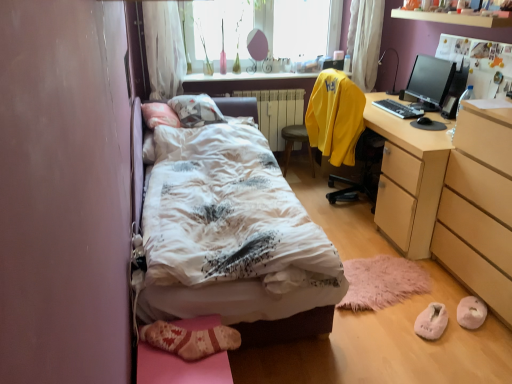
Question: Does wooden shelf at upper center have a larger size compared to white sheer curtain at upper center, which ranks as the 1th curtain in right-to-left order?

Choices:
 (A) yes
 (B) no

Answer: (B)

Question: From the image's perspective, is wooden shelf at upper center below white sheer curtain at upper center, which is the 2th curtain in left-to-right order?

Choices:
 (A) no
 (B) yes

Answer: (B)

Question: Are wooden shelf at upper center and white sheer curtain at upper center, which is the 2th curtain in left-to-right order, located far from each other?

Choices:
 (A) no
 (B) yes

Answer: (A)

Question: Is wooden shelf at upper center facing away from white sheer curtain at upper center, which ranks as the 1th curtain in right-to-left order?

Choices:
 (A) yes
 (B) no

Answer: (B)

Question: Is wooden shelf at upper center beside white sheer curtain at upper center, which ranks as the 1th curtain in right-to-left order?

Choices:
 (A) no
 (B) yes

Answer: (A)

Question: Is point (419, 114) positioned closer to the camera than point (343, 104)?

Choices:
 (A) farther
 (B) closer

Answer: (B)

Question: Would you say black plastic keyboard at right is inside or outside yellow matte sweatshirt at upper right?

Choices:
 (A) inside
 (B) outside

Answer: (B)

Question: Considering their positions, is black plastic keyboard at right located in front of or behind yellow matte sweatshirt at upper right?

Choices:
 (A) behind
 (B) front

Answer: (A)

Question: Looking at their shapes, would you say black plastic keyboard at right is wider or thinner than yellow matte sweatshirt at upper right?

Choices:
 (A) wide
 (B) thin

Answer: (B)

Question: In terms of width, does white metallic radiator at center look wider or thinner when compared to wooden shelf at upper center?

Choices:
 (A) thin
 (B) wide

Answer: (A)

Question: From the image's perspective, is white metallic radiator at center above or below wooden shelf at upper center?

Choices:
 (A) above
 (B) below

Answer: (B)

Question: Is white metallic radiator at center taller or shorter than wooden shelf at upper center?

Choices:
 (A) short
 (B) tall

Answer: (B)

Question: Is white metallic radiator at center spatially inside wooden shelf at upper center, or outside of it?

Choices:
 (A) outside
 (B) inside

Answer: (A)

Question: Relative to black plastic keyboard at right, is white fluffy slippers at lower right, acting as the first shoe starting from the right, in front or behind?

Choices:
 (A) behind
 (B) front

Answer: (B)

Question: In terms of size, does white fluffy slippers at lower right, acting as the first shoe starting from the right, appear bigger or smaller than black plastic keyboard at right?

Choices:
 (A) big
 (B) small

Answer: (B)